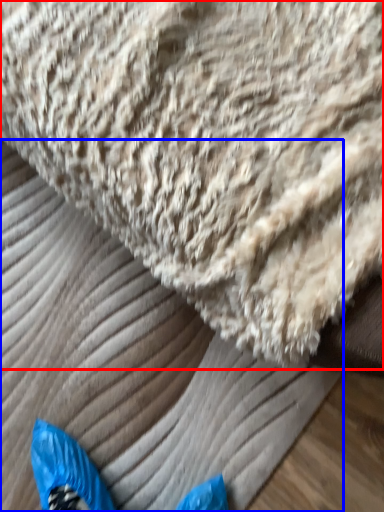
Question: Which object is closer to the camera taking this photo, towel (highlighted by a red box) or sheet (highlighted by a blue box)?

Choices:
 (A) towel
 (B) sheet

Answer: (A)